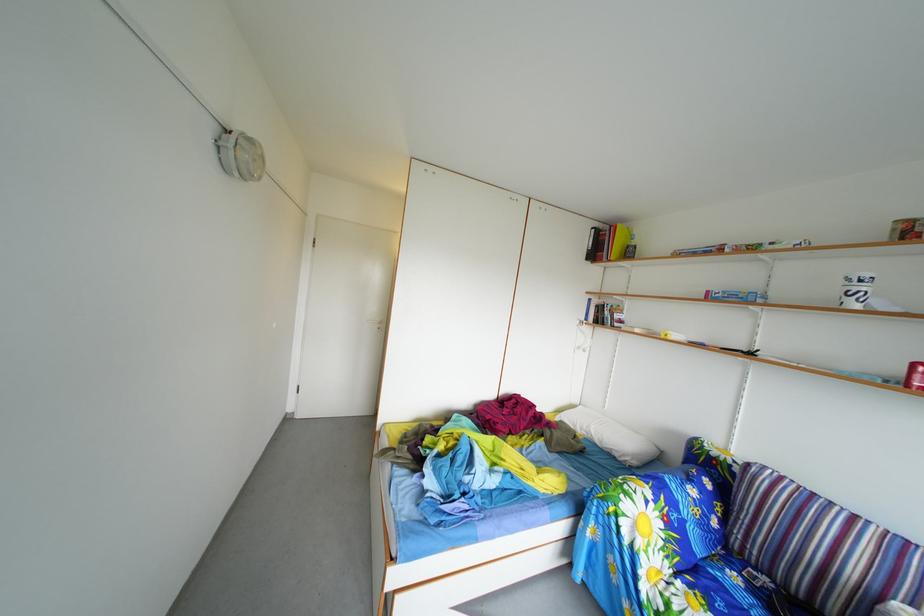
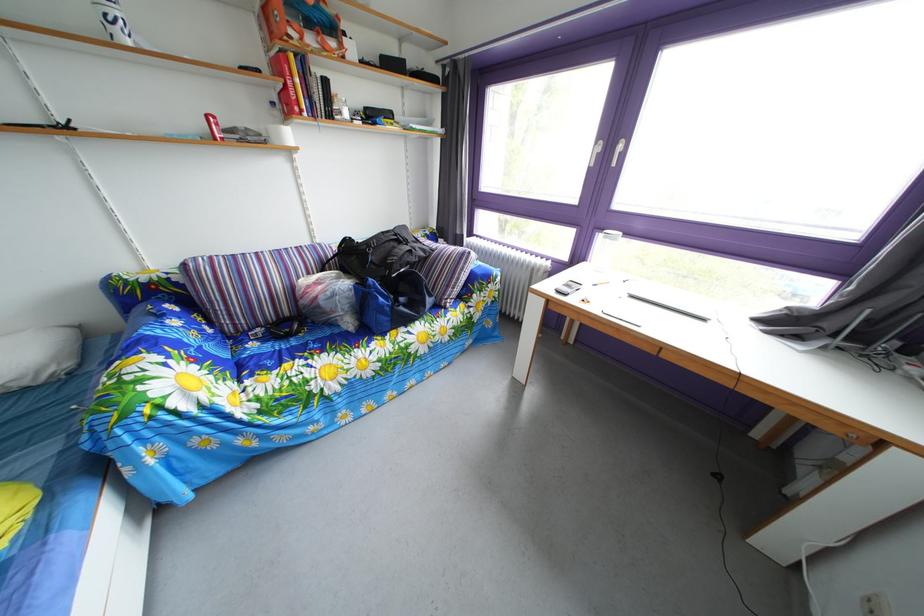
The point at (x=634, y=450) is marked in the first image. Where is the corresponding point in the second image?

(18, 370)